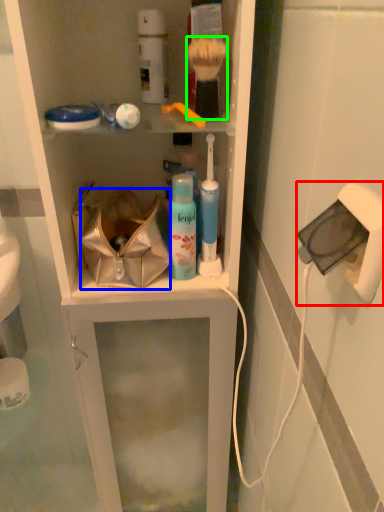
Question: Which is nearer to the electric outlet (highlighted by a red box)? handbag (highlighted by a blue box) or brush (highlighted by a green box).

Choices:
 (A) handbag
 (B) brush

Answer: (B)